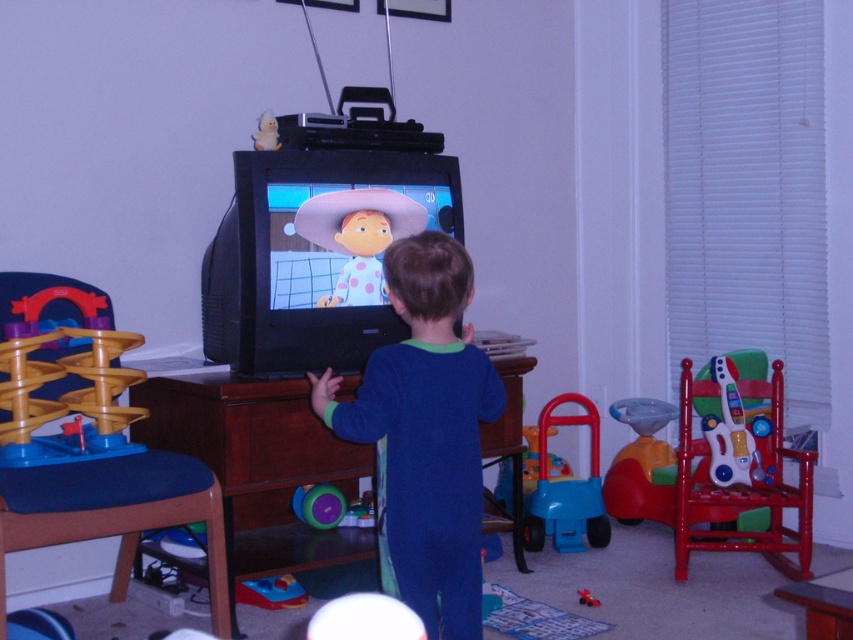
You are a parent trying to store the rubberized plastic walker at lower center and the polka dot fabric cowboy hat at upper center in a rectangular box. The box is just wide enough to fit the wider of the two items. Which item should you measure to determine the minimum width of the box?

You should measure the rubberized plastic walker at lower center because it might be wider than the polka dot fabric cowboy hat at upper center, so the box needs to be at least as wide as the wider item.

You are a parent looking for a place to put your child toys. You have two options in the room, the brown wood dresser at center and the wooden drawer at center. Which one is located to the left side of the other?

The brown wood dresser at center is located to the left of the wooden drawer at center.

You are a parent trying to organize the playroom. You need to place a new toy box that is 10 centimeters wide between the brown wood dresser at center and the wooden drawer at center. Is there enough space?

The distance between the brown wood dresser at center and the wooden drawer at center is 8.41 centimeters. Since the toy box is 10 centimeters wide, it won not fit between them as the available space is smaller than the toy box.